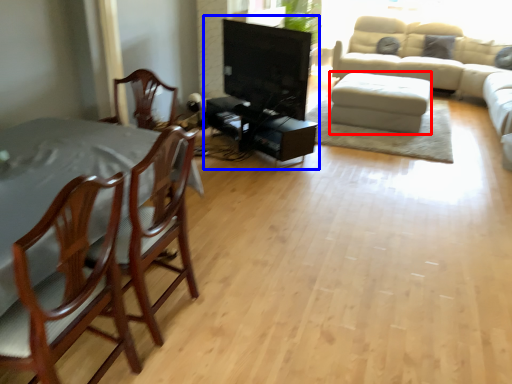
Question: Which of the following is the farthest to the observer, footrest (highlighted by a red box) or entertainment center (highlighted by a blue box)?

Choices:
 (A) footrest
 (B) entertainment center

Answer: (A)